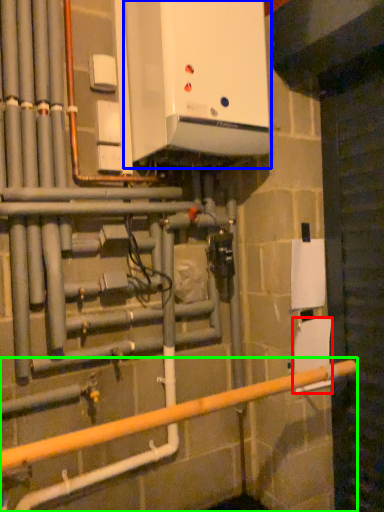
Question: Which object is positioned closest to toilet paper (highlighted by a red box)? Select from home appliance (highlighted by a blue box) and rail (highlighted by a green box).

Choices:
 (A) home appliance
 (B) rail

Answer: (B)